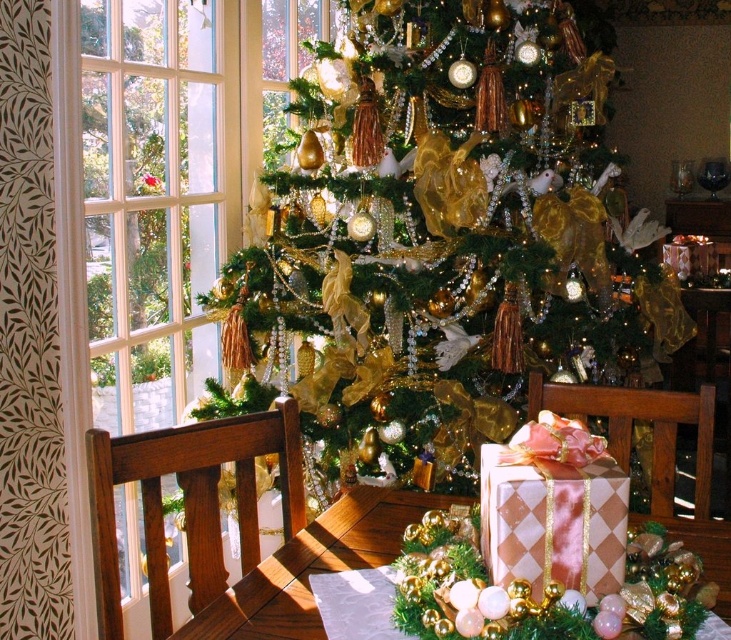
Question: Among these objects, which one is farthest from the camera?

Choices:
 (A) pink satin gift at center
 (B) pink paper gift at center

Answer: (B)

Question: Can you confirm if gold shiny ornaments at center is positioned to the left of pink paper gift at center?

Choices:
 (A) no
 (B) yes

Answer: (A)

Question: Is gold shiny ornaments at center smaller than clear glass window at left?

Choices:
 (A) yes
 (B) no

Answer: (B)

Question: Can you confirm if gold shiny ornaments at center is thinner than pink paper gift at center?

Choices:
 (A) no
 (B) yes

Answer: (A)

Question: Which object is farther from the camera taking this photo?

Choices:
 (A) pink satin gift at center
 (B) gold shiny ornaments at center
 (C) pink paper gift at center
 (D) clear glass window at left

Answer: (B)

Question: Which point is closer to the camera?

Choices:
 (A) pink satin gift at center
 (B) pink paper gift at center
 (C) clear glass window at left

Answer: (A)